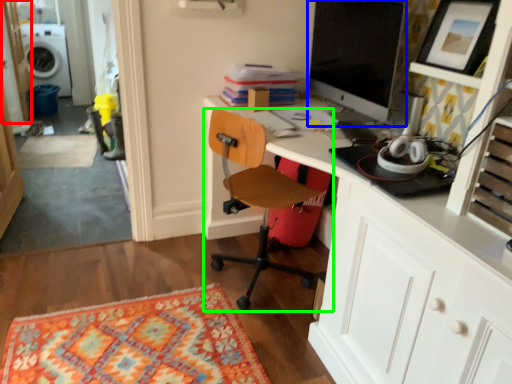
Question: Which object is the farthest from glass door (highlighted by a red box)? Choose among these: computer monitor (highlighted by a blue box) or chair (highlighted by a green box).

Choices:
 (A) computer monitor
 (B) chair

Answer: (A)